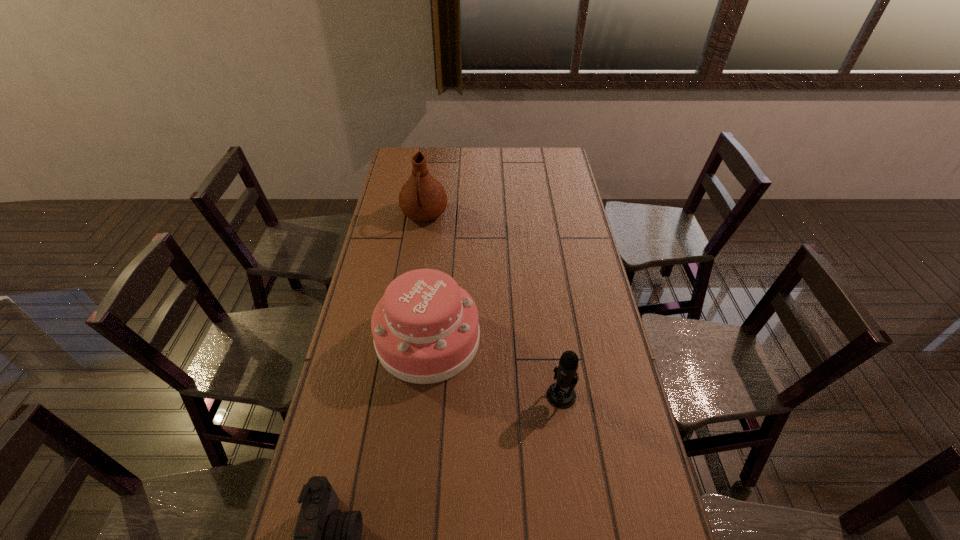
The height and width of the screenshot is (540, 960). What are the coordinates of `vacant space that satisfies the following two spatial constraints: 1. on the side of the pitcher with the handle; 2. on the left side of the birthday cake` in the screenshot? It's located at (406, 340).

I want to click on vacant region that satisfies the following two spatial constraints: 1. on the side of the tallest object with the handle; 2. on the right side of the microphone, so click(x=397, y=395).

Where is `free location that satisfies the following two spatial constraints: 1. on the side of the birthday cake with the handle; 2. on the right side of the pitcher`? free location that satisfies the following two spatial constraints: 1. on the side of the birthday cake with the handle; 2. on the right side of the pitcher is located at coordinates (406, 340).

Locate an element on the screen. This screenshot has width=960, height=540. free space that satisfies the following two spatial constraints: 1. on the side of the pitcher with the handle; 2. on the right side of the birthday cake is located at coordinates (406, 340).

I want to click on free location that satisfies the following two spatial constraints: 1. on the side of the birthday cake with the handle; 2. on the right side of the farthest object, so point(406,340).